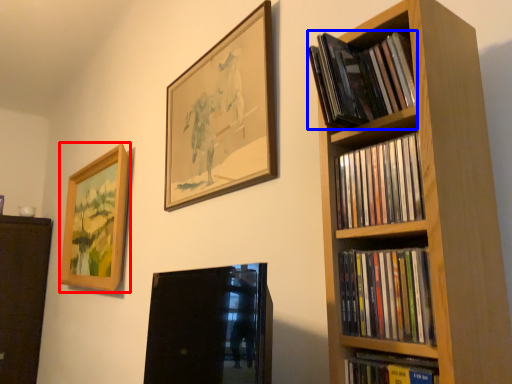
Question: Which point is further to the camera, picture frame (highlighted by a red box) or book (highlighted by a blue box)?

Choices:
 (A) picture frame
 (B) book

Answer: (A)